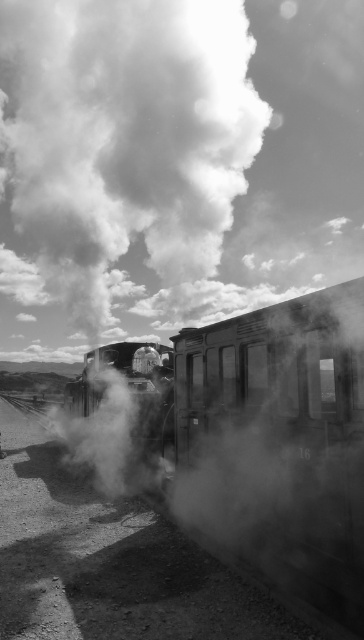
Question: Estimate the real-world distances between objects in this image. Which object is farther from the white smoke at upper center?

Choices:
 (A) smooth metal train at center
 (B) smooth metal steam engine at center

Answer: (A)

Question: Where is smooth metal train at center located in relation to smooth metal steam engine at center in the image?

Choices:
 (A) left
 (B) right

Answer: (B)

Question: Can you confirm if smooth metal train at center is smaller than smooth metal steam engine at center?

Choices:
 (A) no
 (B) yes

Answer: (B)

Question: Which point is closer to the camera taking this photo?

Choices:
 (A) (260, 472)
 (B) (149, 364)

Answer: (A)

Question: Is smooth metal train at center above smooth metal steam engine at center?

Choices:
 (A) yes
 (B) no

Answer: (A)

Question: Among these objects, which one is nearest to the camera?

Choices:
 (A) smooth metal steam engine at center
 (B) white smoke at upper center

Answer: (A)